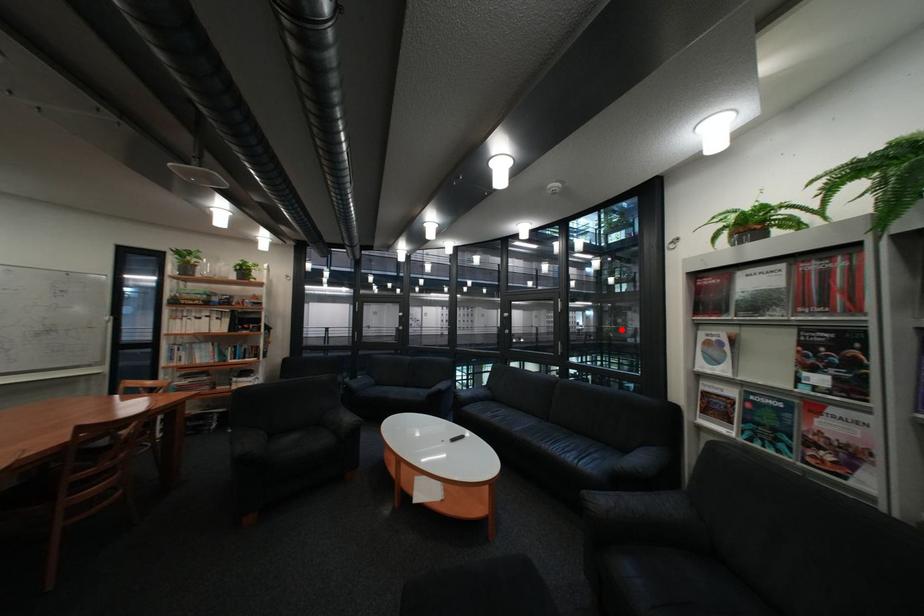
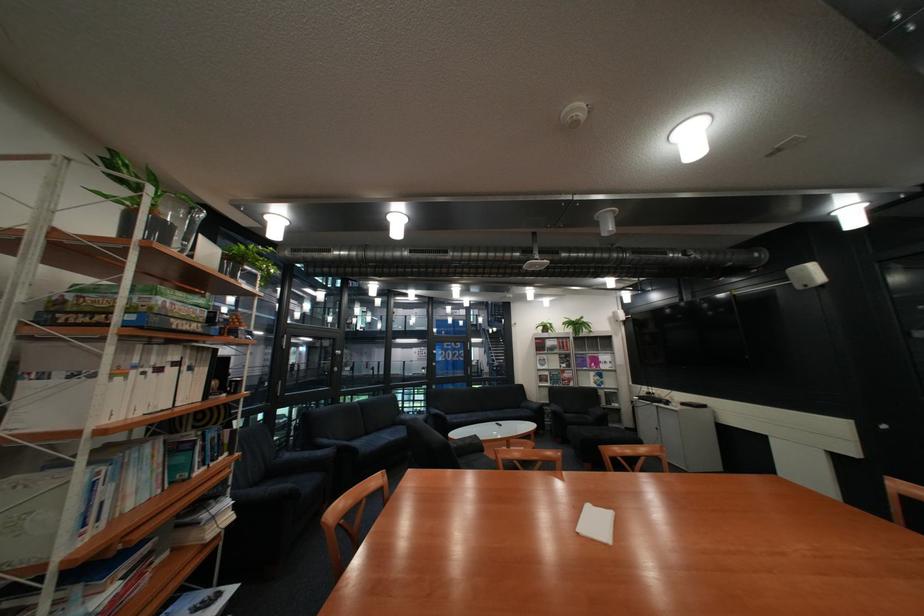
Locate, in the second image, the point that corresponds to the highlighted location in the first image.

(344, 365)